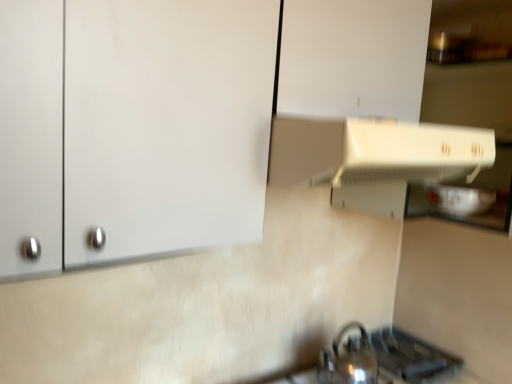
The height and width of the screenshot is (384, 512). Describe the element at coordinates (410, 358) in the screenshot. I see `metallic silver gas stove at lower right` at that location.

What is the approximate width of white matte cabinet at upper left?

white matte cabinet at upper left is 13.24 inches wide.

The height and width of the screenshot is (384, 512). What do you see at coordinates (348, 361) in the screenshot?
I see `shiny metallic tea pot at lower right` at bounding box center [348, 361].

This screenshot has width=512, height=384. In order to click on shiny metallic tea pot at lower right in this screenshot , I will do `click(348, 361)`.

You are a GUI agent. You are given a task and a screenshot of the screen. Output one action in this format:
    pyautogui.click(x=<x>, y=<y>)
    Task: Click on the metallic silver gas stove at lower right
    
    Given the screenshot: What is the action you would take?
    pyautogui.click(x=410, y=358)

Is shiny metallic tea pot at lower right wider or thinner than white matte cabinet at upper left?

Clearly, shiny metallic tea pot at lower right has less width compared to white matte cabinet at upper left.

Which object is closer to the camera, shiny metallic tea pot at lower right or white matte cabinet at upper left?

white matte cabinet at upper left is closer to the camera.

From the image's perspective, which is above, shiny metallic tea pot at lower right or white matte cabinet at upper left?

white matte cabinet at upper left is shown above in the image.

Which object is positioned more to the right, shiny metallic tea pot at lower right or white matte cabinet at upper left?

shiny metallic tea pot at lower right.

From the image's perspective, which object appears higher, white matte cabinet at upper left or metallic silver gas stove at lower right?

white matte cabinet at upper left appears higher in the image.

Where is `gas stove that appears below the white matte cabinet at upper left (from the image's perspective)`? The width and height of the screenshot is (512, 384). gas stove that appears below the white matte cabinet at upper left (from the image's perspective) is located at coordinates (410, 358).

Which object is wider, white matte cabinet at upper left or metallic silver gas stove at lower right?

white matte cabinet at upper left.

How different are the orientations of white matte cabinet at upper left and metallic silver gas stove at lower right in degrees?

There is a 90.4-degree angle between the facing directions of white matte cabinet at upper left and metallic silver gas stove at lower right.

From a real-world perspective, between metallic silver gas stove at lower right and white matte cabinet at upper left, who is vertically lower?

In real-world perspective, metallic silver gas stove at lower right is lower.

Which object is positioned more to the right, metallic silver gas stove at lower right or white matte cabinet at upper left?

Positioned to the right is metallic silver gas stove at lower right.

Which of these two, metallic silver gas stove at lower right or white matte cabinet at upper left, stands taller?

white matte cabinet at upper left.

Would you consider metallic silver gas stove at lower right to be distant from white matte cabinet at upper left?

No, metallic silver gas stove at lower right is not far away from white matte cabinet at upper left.

What's the angular difference between white matte cabinet at upper left and shiny metallic tea pot at lower right's facing directions?

1.33 degrees separate the facing orientations of white matte cabinet at upper left and shiny metallic tea pot at lower right.

I want to click on tea pot on the right of white matte cabinet at upper left, so click(x=348, y=361).

Is white matte cabinet at upper left situated inside shiny metallic tea pot at lower right or outside?

white matte cabinet at upper left exists outside the volume of shiny metallic tea pot at lower right.

Based on the photo, considering the relative sizes of white matte cabinet at upper left and shiny metallic tea pot at lower right in the image provided, is white matte cabinet at upper left smaller than shiny metallic tea pot at lower right?

Incorrect, white matte cabinet at upper left is not smaller in size than shiny metallic tea pot at lower right.

In the image, is shiny metallic tea pot at lower right on the left side or the right side of metallic silver gas stove at lower right?

In the image, shiny metallic tea pot at lower right appears on the left side of metallic silver gas stove at lower right.

Is shiny metallic tea pot at lower right turned away from metallic silver gas stove at lower right?

No, metallic silver gas stove at lower right is not at the back of shiny metallic tea pot at lower right.

Between shiny metallic tea pot at lower right and metallic silver gas stove at lower right, which one has smaller size?

metallic silver gas stove at lower right.

Does point (332, 355) lie behind point (414, 349)?

No, (332, 355) is closer to viewer.

Between metallic silver gas stove at lower right and shiny metallic tea pot at lower right, which one has less height?

metallic silver gas stove at lower right.

Is metallic silver gas stove at lower right far away from shiny metallic tea pot at lower right?

No, there isn't a large distance between metallic silver gas stove at lower right and shiny metallic tea pot at lower right.

Considering the positions of objects metallic silver gas stove at lower right and shiny metallic tea pot at lower right in the image provided, who is behind, metallic silver gas stove at lower right or shiny metallic tea pot at lower right?

metallic silver gas stove at lower right is further from the camera.

Looking at this image, is metallic silver gas stove at lower right outside of shiny metallic tea pot at lower right?

metallic silver gas stove at lower right lies outside shiny metallic tea pot at lower right's area.

The width and height of the screenshot is (512, 384). I want to click on cabinetry located on the left of shiny metallic tea pot at lower right, so click(176, 116).

At what (x,y) coordinates should I click in order to perform the action: click on gas stove directly beneath the white matte cabinet at upper left (from a real-world perspective). Please return your answer as a coordinate pair (x, y). This screenshot has height=384, width=512. Looking at the image, I should click on (410, 358).

When comparing their distances from shiny metallic tea pot at lower right, does metallic silver gas stove at lower right or white matte cabinet at upper left seem further?

The object further to shiny metallic tea pot at lower right is white matte cabinet at upper left.

Which object lies nearer to the anchor point metallic silver gas stove at lower right, shiny metallic tea pot at lower right or white matte cabinet at upper left?

shiny metallic tea pot at lower right lies closer to metallic silver gas stove at lower right than the other object.

When comparing their distances from shiny metallic tea pot at lower right, does white matte cabinet at upper left or metallic silver gas stove at lower right seem further?

Based on the image, white matte cabinet at upper left appears to be further to shiny metallic tea pot at lower right.

When comparing their distances from metallic silver gas stove at lower right, does white matte cabinet at upper left or shiny metallic tea pot at lower right seem further?

Among the two, white matte cabinet at upper left is located further to metallic silver gas stove at lower right.

Estimate the real-world distances between objects in this image. Which object is closer to white matte cabinet at upper left, shiny metallic tea pot at lower right or metallic silver gas stove at lower right?

Among the two, shiny metallic tea pot at lower right is located nearer to white matte cabinet at upper left.

Looking at the image, which one is located closer to white matte cabinet at upper left, metallic silver gas stove at lower right or shiny metallic tea pot at lower right?

shiny metallic tea pot at lower right lies closer to white matte cabinet at upper left than the other object.

In order to click on tea pot between white matte cabinet at upper left and metallic silver gas stove at lower right in the vertical direction in this screenshot , I will do `click(348, 361)`.